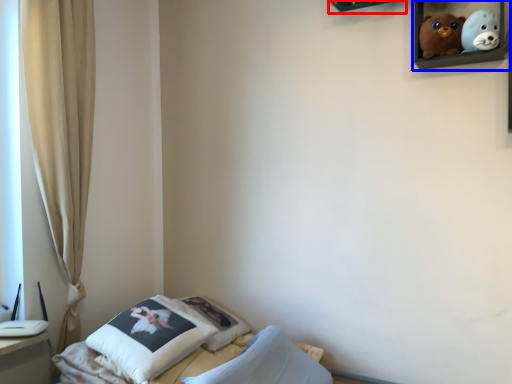
Question: Which object appears closest to the camera in this image, shelf (highlighted by a red box) or picture frame (highlighted by a blue box)?

Choices:
 (A) shelf
 (B) picture frame

Answer: (B)